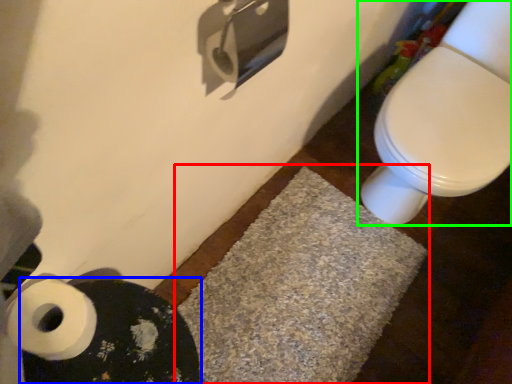
Question: Which is nearer to the bath mat (highlighted by a red box)? bath mat (highlighted by a blue box) or toilet (highlighted by a green box).

Choices:
 (A) bath mat
 (B) toilet

Answer: (B)